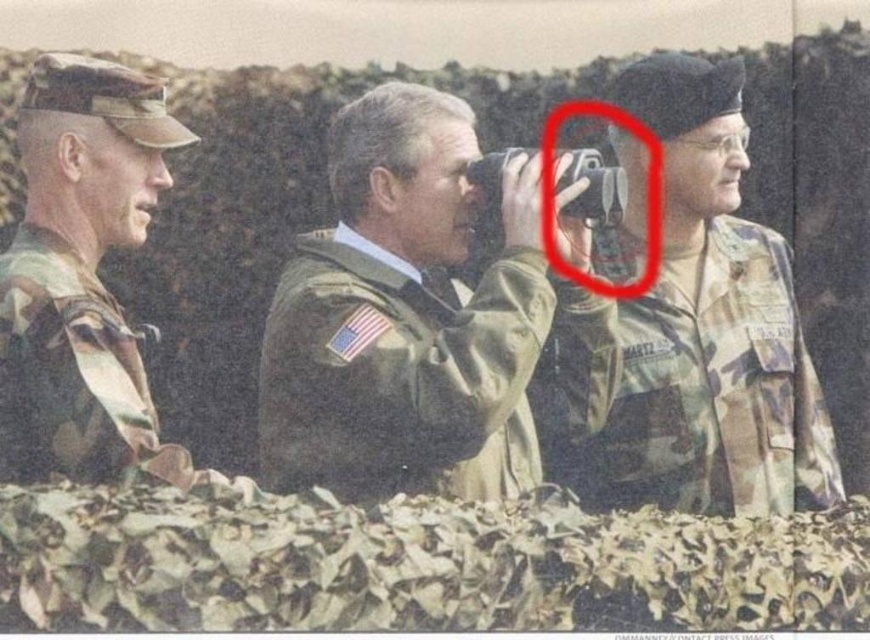
What object is located at the point with coordinates (405, 317)?

The point at coordinates (405, 317) marks the camouflage jacket at center.

You are a military medic who needs to quickly assess the situation. Which of the two soldiers, the camo fabric uniform at center or the camo uniform at left, is positioned lower in the image?

The camo fabric uniform at center is located below the camo uniform at left, so the camo fabric uniform at center is positioned lower in the image.

You are a military medic positioned behind the camouflage netting. You need to quickly assess the location of the camo fabric uniform at center. Based on the coordinates provided, is this individual positioned to your left or right side?

The camo fabric uniform at center is located at point 0.613 on the x and 0.798 on the y, so the individual is positioned to your right side.